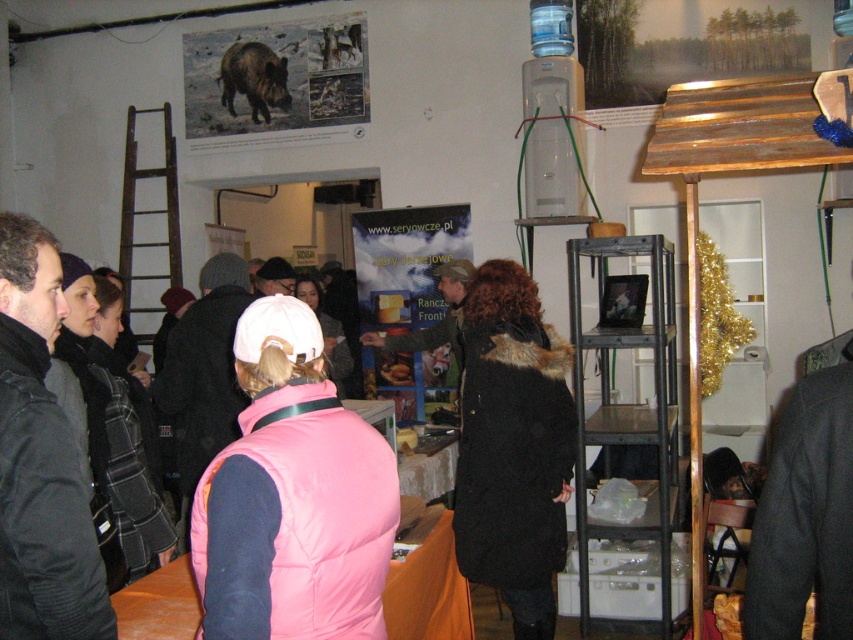
Does point (79, 532) lie behind point (256, 61)?

No, (79, 532) is in front of (256, 61).

Image resolution: width=853 pixels, height=640 pixels. What do you see at coordinates (39, 460) in the screenshot? I see `black woolen jacket at left` at bounding box center [39, 460].

The image size is (853, 640). Identify the location of black woolen jacket at left. (39, 460).

Does pink puffy vest at center have a greater width compared to brown furry wild boar at upper left?

No, pink puffy vest at center is not wider than brown furry wild boar at upper left.

Describe the element at coordinates (293, 497) in the screenshot. I see `pink puffy vest at center` at that location.

Image resolution: width=853 pixels, height=640 pixels. Identify the location of pink puffy vest at center. (293, 497).

In the scene shown: Is pink puffy vest at center to the left of black woolen jacket at left from the viewer's perspective?

In fact, pink puffy vest at center is to the right of black woolen jacket at left.

Is pink puffy vest at center above black woolen jacket at left?

No.

Is point (355, 456) in front of point (25, 371)?

Yes.

What are the coordinates of `pink puffy vest at center` in the screenshot? It's located at (293, 497).